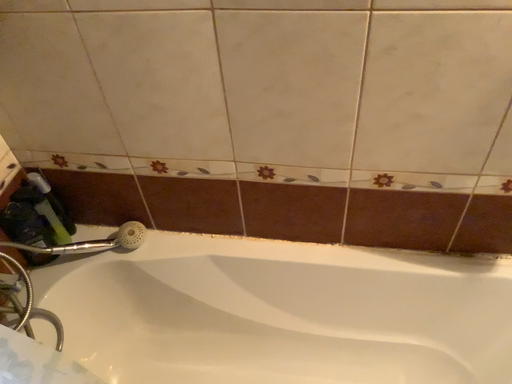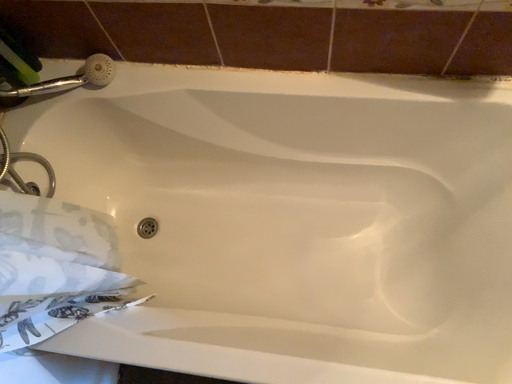
Question: How did the camera likely rotate when shooting the video?

Choices:
 (A) rotated downward
 (B) rotated upward

Answer: (A)